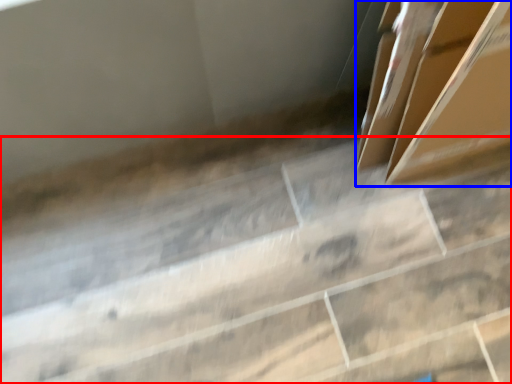
Question: Which object is further to the camera taking this photo, concrete (highlighted by a red box) or box (highlighted by a blue box)?

Choices:
 (A) concrete
 (B) box

Answer: (A)